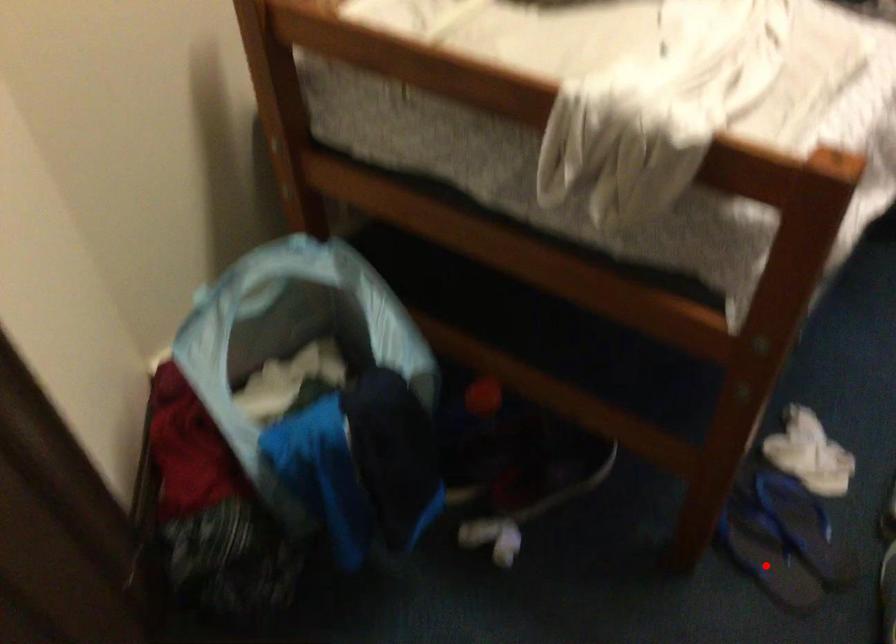
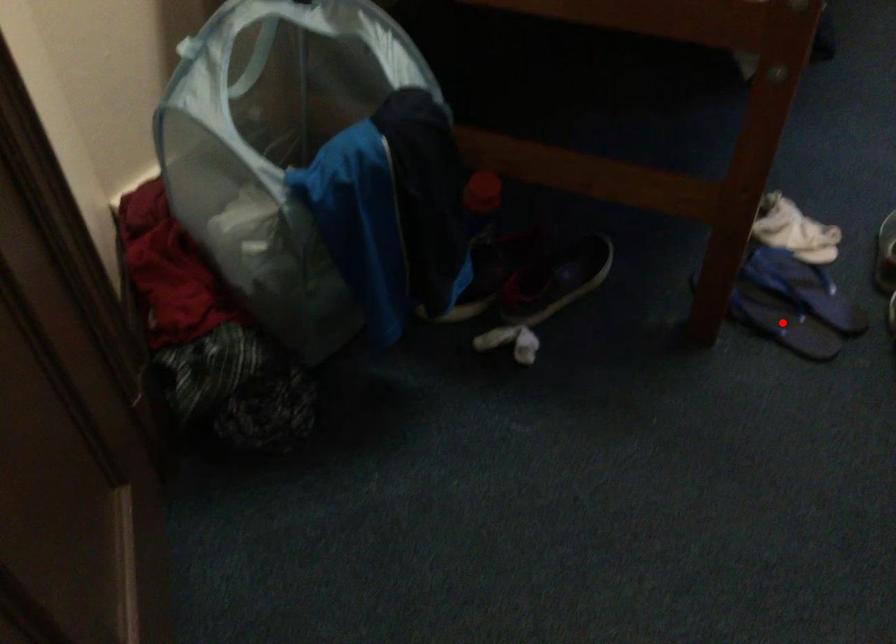
I am providing you with two images of the same scene from different viewpoints. A red point is marked on the first image and another point is marked on the second image. Is the marked point in image1 the same physical position as the marked point in image2?

Yes